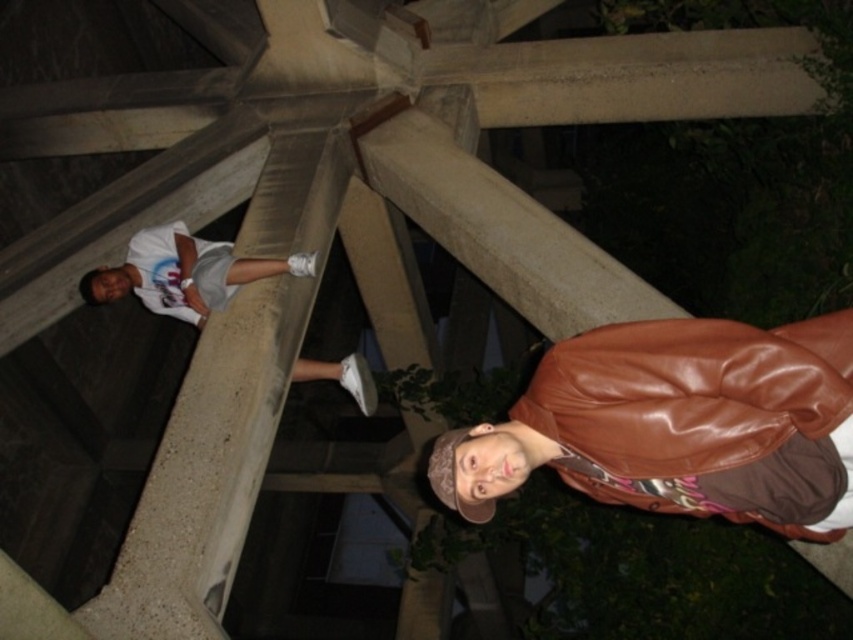
Question: Is brown leather jacket at lower right bigger than white cotton shirt at upper left?

Choices:
 (A) yes
 (B) no

Answer: (A)

Question: Which point is farther to the camera?

Choices:
 (A) (752, 477)
 (B) (178, 225)

Answer: (B)

Question: Which point is closer to the camera taking this photo?

Choices:
 (A) (454, 442)
 (B) (175, 221)

Answer: (A)

Question: Can you confirm if brown leather jacket at lower right is smaller than white cotton shirt at upper left?

Choices:
 (A) yes
 (B) no

Answer: (B)

Question: Which point appears farthest from the camera in this image?

Choices:
 (A) (196, 262)
 (B) (682, 348)

Answer: (A)

Question: In this image, where is brown leather jacket at lower right located relative to white cotton shirt at upper left?

Choices:
 (A) left
 (B) right

Answer: (B)